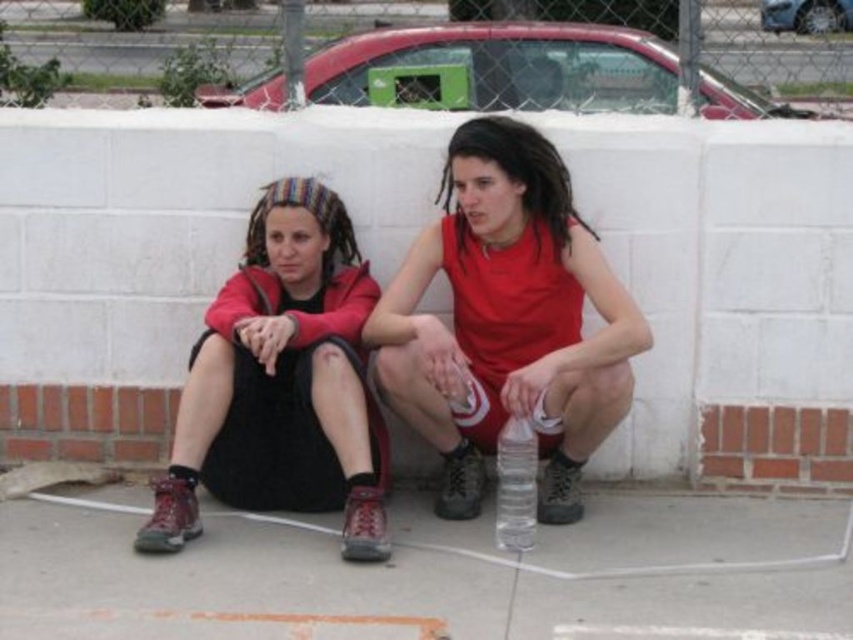
You are standing in front of the two people resting against the white brick wall. You want to place a small flowerpot exactly at the point closer to you between the two points marked as point 1 at (815, 561) and point 2 at (434, 264). Which point should you choose?

You should choose point 1 at (815, 561) because it is closer to the viewer than point 2 at (434, 264).